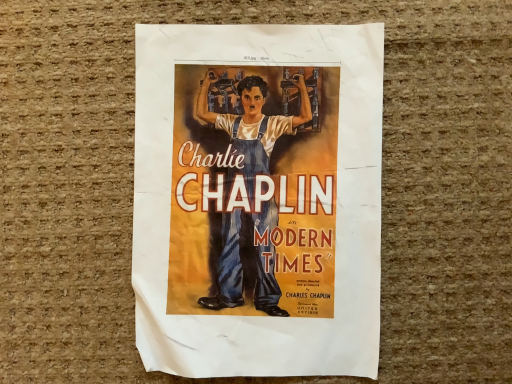
What do you see at coordinates (258, 199) in the screenshot? I see `matte paper poster at center` at bounding box center [258, 199].

At what (x,y) coordinates should I click in order to perform the action: click on matte paper poster at center. Please return your answer as a coordinate pair (x, y). The height and width of the screenshot is (384, 512). Looking at the image, I should click on (258, 199).

The width and height of the screenshot is (512, 384). Find the location of `matte paper poster at center`. matte paper poster at center is located at coordinates (258, 199).